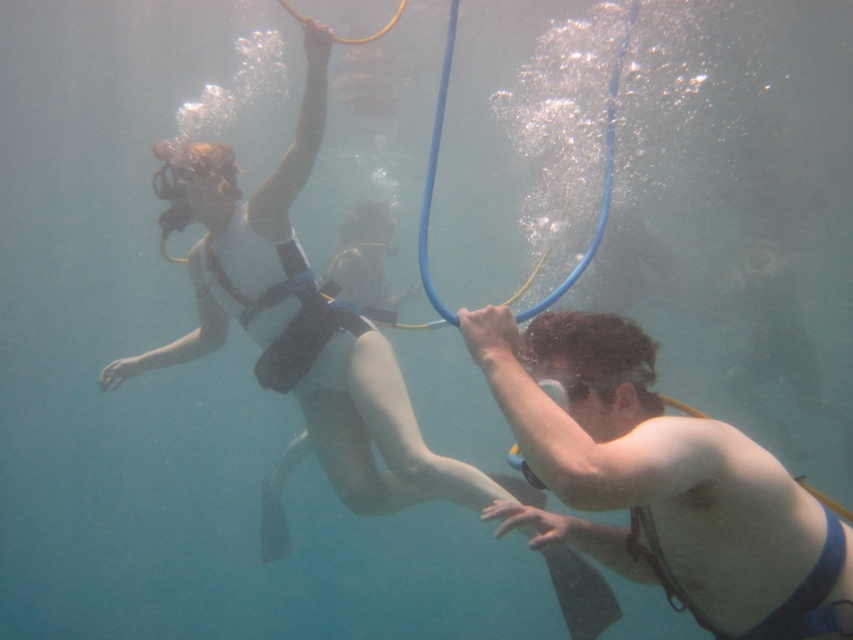
Question: Among these points, which one is farthest from the camera?

Choices:
 (A) [701, 452]
 (B) [212, 292]

Answer: (B)

Question: Is smooth skin diver at center behind matte black wetsuit at center?

Choices:
 (A) no
 (B) yes

Answer: (A)

Question: Which point is closer to the camera?

Choices:
 (A) (238, 276)
 (B) (630, 532)

Answer: (B)

Question: Is smooth skin diver at center thinner than matte black wetsuit at center?

Choices:
 (A) no
 (B) yes

Answer: (B)

Question: Which point appears closest to the camera in this image?

Choices:
 (A) (671, 556)
 (B) (300, 176)

Answer: (A)

Question: Is smooth skin diver at center smaller than matte black wetsuit at center?

Choices:
 (A) no
 (B) yes

Answer: (B)